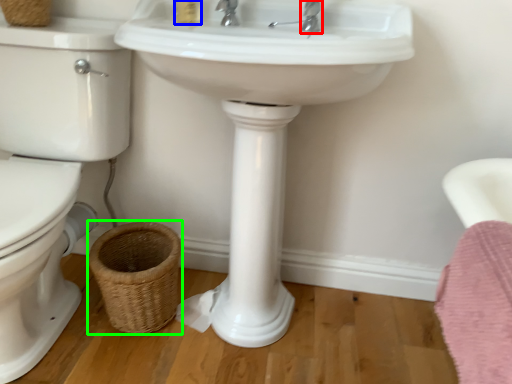
Question: Estimate the real-world distances between objects in this image. Which object is closer to plumbing fixture (highlighted by a red box), toiletry (highlighted by a blue box) or basket (highlighted by a green box)?

Choices:
 (A) toiletry
 (B) basket

Answer: (A)